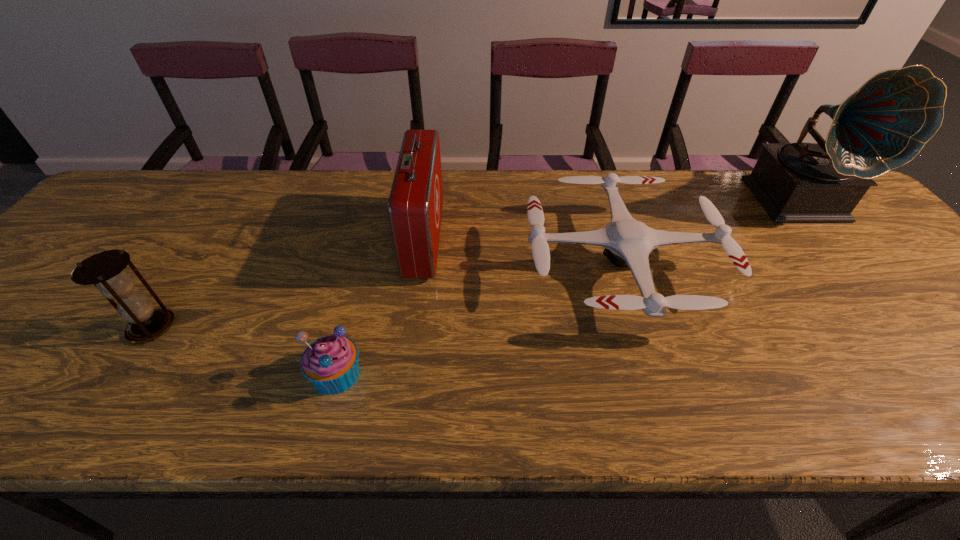
Where is `vacant space located 0.160m on the side of the second tallest object with the first aid cross symbol`? vacant space located 0.160m on the side of the second tallest object with the first aid cross symbol is located at coordinates (501, 239).

Where is `vacant region located on the right of the leftmost object`? The width and height of the screenshot is (960, 540). vacant region located on the right of the leftmost object is located at coordinates (202, 327).

Find the location of a particular element. vacant area located with the camera attached at the bottom of the second object from right to left is located at coordinates (437, 265).

The height and width of the screenshot is (540, 960). What are the coordinates of `vacant space located 0.140m with the camera attached at the bottom of the second object from right to left` in the screenshot? It's located at (469, 265).

Identify the location of free point located with the camera attached at the bottom of the second object from right to left. This screenshot has width=960, height=540. (405, 265).

This screenshot has width=960, height=540. Find the location of `vacant space located on the left of the nearest object`. vacant space located on the left of the nearest object is located at coordinates (159, 373).

In order to click on record player situated at the far edge in this screenshot , I will do `click(883, 125)`.

In order to click on the first-aid kit that is at the far edge in this screenshot , I will do pos(415,204).

Where is `drone that is at the far edge`? drone that is at the far edge is located at coordinates (627, 242).

The image size is (960, 540). Identify the location of object located at the near edge. (331, 363).